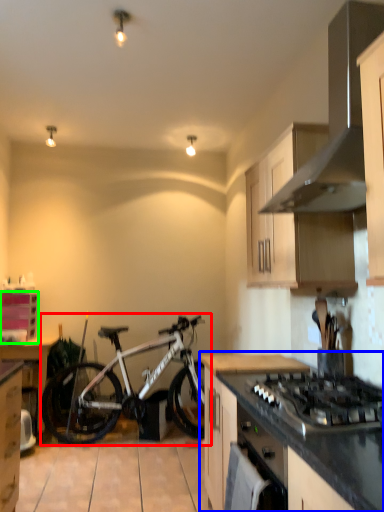
Question: Which is farther away from bicycle (highlighted by a red box)? countertop (highlighted by a blue box) or cabinetry (highlighted by a green box)?

Choices:
 (A) countertop
 (B) cabinetry

Answer: (A)